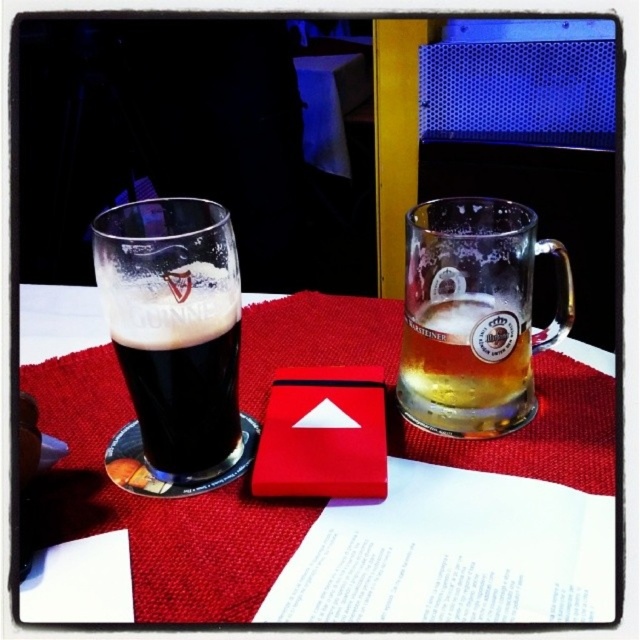
You are a bartender who needs to place a new drink order on the table. The table has a coordinate system where the bottom left corner is the origin point. The translucent glass mug at upper right is already placed at position 0.494, 0.741. Where should you place the new drink so it doesn t interfere with the existing mug?

The translucent glass mug at upper right is located at coordinate point (474, 316). To avoid interference, place the new drink in an area with coordinates that do not overlap with this position, such as near the lower left corner of the table.

Looking at this image, you are a bartender who needs to place a 20 cm wide menu on the table. The red fabric placemat at center is currently occupying space. Can you fit the menu next to it without overlapping?

The red fabric placemat at center is 22.74 centimeters away from the viewer, so there is enough space to place the 20 cm wide menu next to it without overlapping.

You are a bartender trying to place a new drink order on the table. The red fabric placemat at center and the dark glass at left are already there. Which object is closer to the edge of the table?

The dark glass at left is closer to the edge of the table because it is taller than the red fabric placemat at center, making it more likely to be positioned near the edge for accessibility.